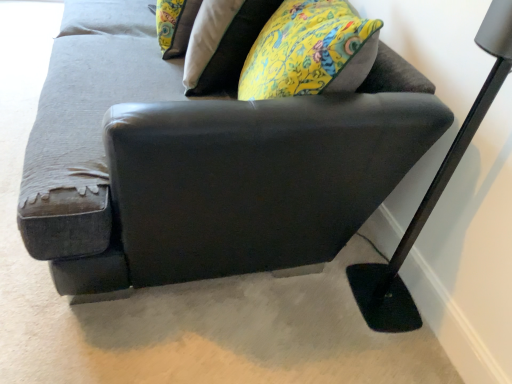
Question: From a real-world perspective, is dark gray fabric couch at center under black metal floor lamp at lower right?

Choices:
 (A) yes
 (B) no

Answer: (A)

Question: Are dark gray fabric couch at center and black metal floor lamp at lower right located far from each other?

Choices:
 (A) yes
 (B) no

Answer: (B)

Question: Does dark gray fabric couch at center have a greater width compared to black metal floor lamp at lower right?

Choices:
 (A) yes
 (B) no

Answer: (A)

Question: Is dark gray fabric couch at center directly adjacent to black metal floor lamp at lower right?

Choices:
 (A) no
 (B) yes

Answer: (A)

Question: Considering the relative positions of dark gray fabric couch at center and black metal floor lamp at lower right in the image provided, is dark gray fabric couch at center to the right of black metal floor lamp at lower right from the viewer's perspective?

Choices:
 (A) no
 (B) yes

Answer: (A)

Question: Looking at their shapes, would you say black metal floor lamp at lower right is wider or thinner than dark gray fabric couch at center?

Choices:
 (A) thin
 (B) wide

Answer: (A)

Question: Looking at the image, does black metal floor lamp at lower right seem bigger or smaller compared to dark gray fabric couch at center?

Choices:
 (A) big
 (B) small

Answer: (B)

Question: Relative to dark gray fabric couch at center, is black metal floor lamp at lower right in front or behind?

Choices:
 (A) front
 (B) behind

Answer: (B)

Question: Which is correct: black metal floor lamp at lower right is inside dark gray fabric couch at center, or outside of it?

Choices:
 (A) outside
 (B) inside

Answer: (A)

Question: Considering the positions of dark gray fabric couch at center and floral fabric pillow at upper center in the image, is dark gray fabric couch at center bigger or smaller than floral fabric pillow at upper center?

Choices:
 (A) big
 (B) small

Answer: (A)

Question: Looking at their shapes, would you say dark gray fabric couch at center is wider or thinner than floral fabric pillow at upper center?

Choices:
 (A) wide
 (B) thin

Answer: (A)

Question: Is dark gray fabric couch at center inside the boundaries of floral fabric pillow at upper center, or outside?

Choices:
 (A) outside
 (B) inside

Answer: (A)

Question: In terms of height, does dark gray fabric couch at center look taller or shorter compared to floral fabric pillow at upper center?

Choices:
 (A) short
 (B) tall

Answer: (B)

Question: Is point (380, 264) positioned closer to the camera than point (186, 3)?

Choices:
 (A) closer
 (B) farther

Answer: (A)

Question: Based on their positions, is black metal floor lamp at lower right located to the left or right of floral fabric pillow at upper center?

Choices:
 (A) left
 (B) right

Answer: (B)